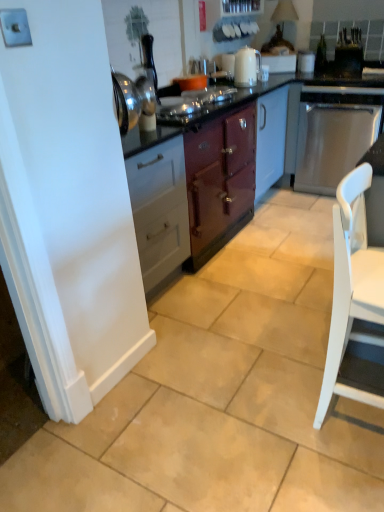
At what (x,y) coordinates should I click in order to perform the action: click on free spot behind white matte chair at lower right. Please return your answer as a coordinate pair (x, y). Looking at the image, I should click on coord(301,350).